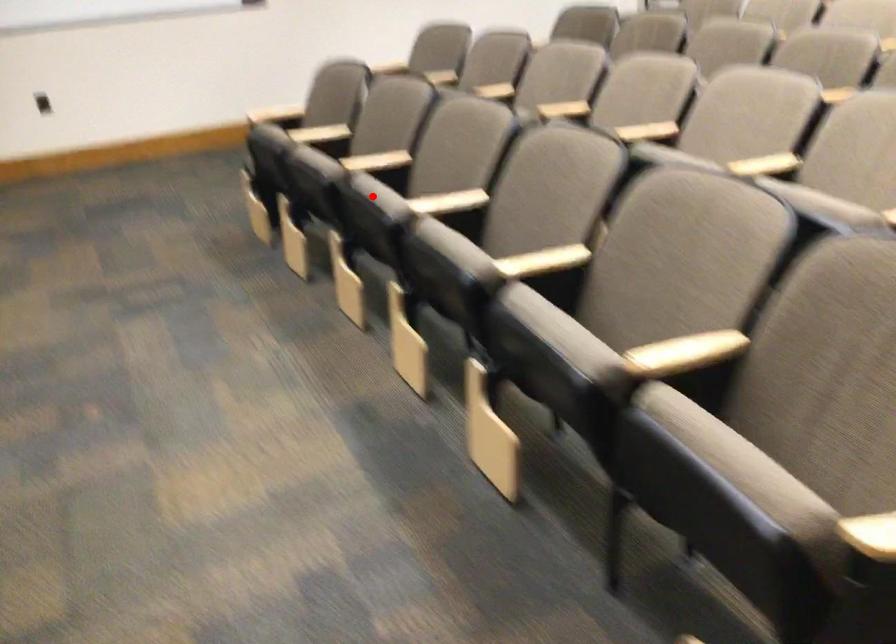
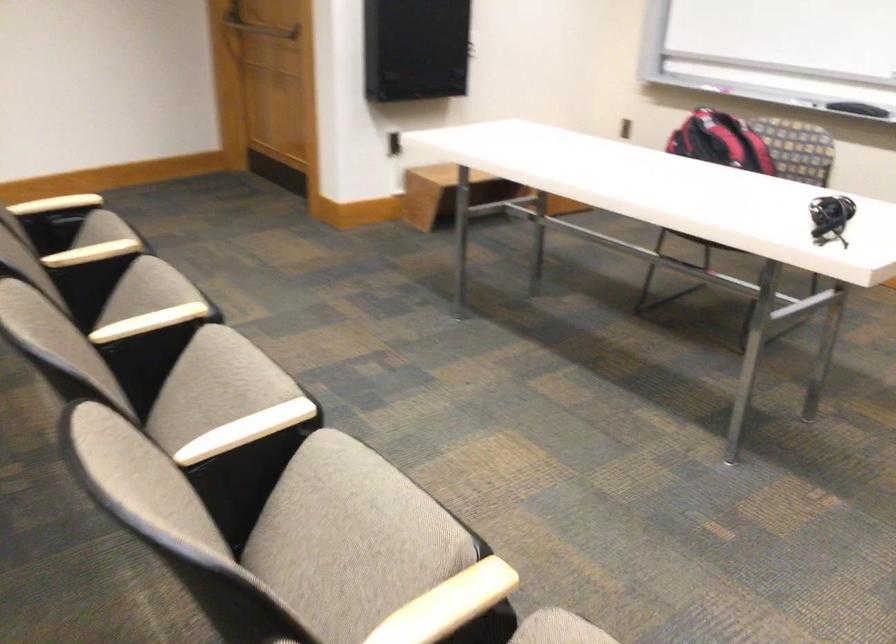
Question: I am providing you with two images of the same scene from different viewpoints. In image1, a red point is highlighted. Considering the same 3D point in image2, which of the following is correct?

Choices:
 (A) It is closer
 (B) It is farther

Answer: (A)